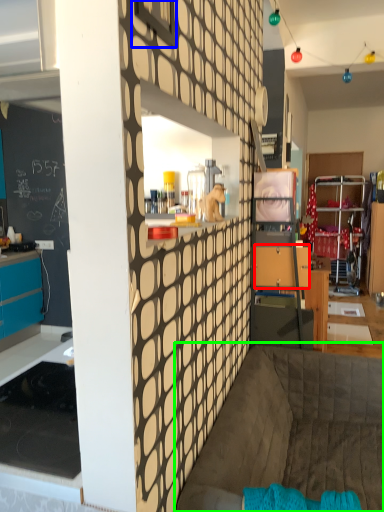
Question: Estimate the real-world distances between objects in this image. Which object is closer to drawer (highlighted by a red box), window (highlighted by a blue box) or couch (highlighted by a green box)?

Choices:
 (A) window
 (B) couch

Answer: (B)